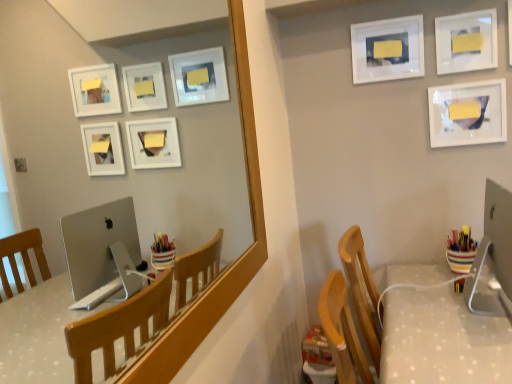
Question: Is matte wooden mirror at upper center surrounded by white glossy picture frame at upper right, acting as the 3th picture frame starting from the left?

Choices:
 (A) yes
 (B) no

Answer: (B)

Question: Is white glossy picture frame at upper right, acting as the 3th picture frame starting from the left, completely or partially outside of matte wooden mirror at upper center?

Choices:
 (A) no
 (B) yes

Answer: (B)

Question: Can you confirm if white glossy picture frame at upper right, which is the 1th picture frame from right to left, is positioned to the left of matte wooden mirror at upper center?

Choices:
 (A) no
 (B) yes

Answer: (A)

Question: Can you confirm if white glossy picture frame at upper right, acting as the 3th picture frame starting from the left, is shorter than matte wooden mirror at upper center?

Choices:
 (A) no
 (B) yes

Answer: (B)

Question: From the image's perspective, is white glossy picture frame at upper right, acting as the 3th picture frame starting from the left, located beneath matte wooden mirror at upper center?

Choices:
 (A) no
 (B) yes

Answer: (A)

Question: Does white glossy picture frame at upper right, acting as the 3th picture frame starting from the left, have a greater height compared to matte wooden mirror at upper center?

Choices:
 (A) no
 (B) yes

Answer: (A)

Question: Considering the relative sizes of white glossy picture frame at upper right, acting as the second picture frame starting from the right, and white dotted fabric table at lower right in the image provided, is white glossy picture frame at upper right, acting as the second picture frame starting from the right, thinner than white dotted fabric table at lower right?

Choices:
 (A) no
 (B) yes

Answer: (B)

Question: Does white glossy picture frame at upper right, acting as the second picture frame starting from the right, appear on the left side of white dotted fabric table at lower right?

Choices:
 (A) no
 (B) yes

Answer: (A)

Question: Is white glossy picture frame at upper right, acting as the second picture frame starting from the right, oriented towards white dotted fabric table at lower right?

Choices:
 (A) no
 (B) yes

Answer: (A)

Question: Does white glossy picture frame at upper right, the 2th picture frame from the left, have a smaller size compared to white dotted fabric table at lower right?

Choices:
 (A) no
 (B) yes

Answer: (B)

Question: From the image's perspective, is white glossy picture frame at upper right, the 2th picture frame from the left, located beneath white dotted fabric table at lower right?

Choices:
 (A) yes
 (B) no

Answer: (B)

Question: Considering the relative sizes of white glossy picture frame at upper right, the 2th picture frame from the left, and white dotted fabric table at lower right in the image provided, is white glossy picture frame at upper right, the 2th picture frame from the left, shorter than white dotted fabric table at lower right?

Choices:
 (A) no
 (B) yes

Answer: (B)

Question: Could you tell me if matte wooden mirror at upper center is turned towards white glossy picture frame at upper right, acting as the 3th picture frame starting from the left?

Choices:
 (A) yes
 (B) no

Answer: (B)